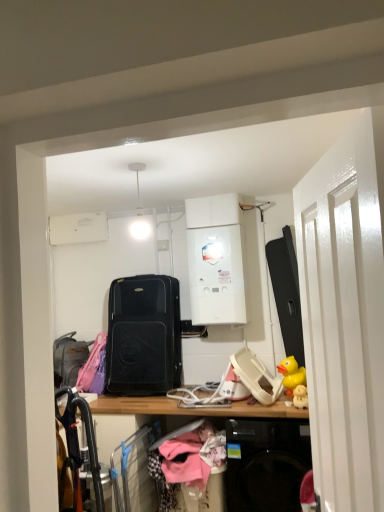
Question: Is white glossy boiler at center to the right of yellow rubber duck at right from the viewer's perspective?

Choices:
 (A) no
 (B) yes

Answer: (A)

Question: From a real-world perspective, is white glossy boiler at center on yellow rubber duck at right?

Choices:
 (A) no
 (B) yes

Answer: (B)

Question: Can you confirm if white glossy boiler at center is positioned to the left of yellow rubber duck at right?

Choices:
 (A) yes
 (B) no

Answer: (A)

Question: Considering the relative sizes of white glossy boiler at center and yellow rubber duck at right in the image provided, is white glossy boiler at center smaller than yellow rubber duck at right?

Choices:
 (A) yes
 (B) no

Answer: (B)

Question: Can you confirm if white glossy boiler at center is wider than yellow rubber duck at right?

Choices:
 (A) no
 (B) yes

Answer: (B)

Question: Does white glossy boiler at center have a lesser width compared to yellow rubber duck at right?

Choices:
 (A) yes
 (B) no

Answer: (B)

Question: From a real-world perspective, is white glossy door at right beneath black matte suitcase at center?

Choices:
 (A) yes
 (B) no

Answer: (B)

Question: Is white glossy door at right next to black matte suitcase at center and touching it?

Choices:
 (A) yes
 (B) no

Answer: (B)

Question: Can you confirm if white glossy door at right is positioned to the left of black matte suitcase at center?

Choices:
 (A) yes
 (B) no

Answer: (B)

Question: Does white glossy door at right have a greater height compared to black matte suitcase at center?

Choices:
 (A) yes
 (B) no

Answer: (A)

Question: Is white glossy door at right positioned behind black matte suitcase at center?

Choices:
 (A) no
 (B) yes

Answer: (A)

Question: Is white glossy door at right turned away from black matte suitcase at center?

Choices:
 (A) no
 (B) yes

Answer: (A)

Question: Is yellow rubber duck at right facing towards gray fabric suitcase at left?

Choices:
 (A) no
 (B) yes

Answer: (A)